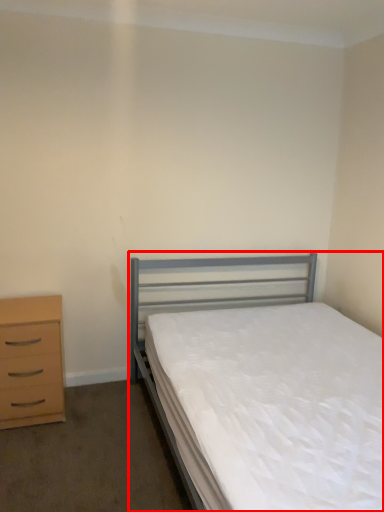
Question: From the image's perspective, where is bed (annotated by the red box) located in relation to chest of drawers in the image?

Choices:
 (A) above
 (B) below

Answer: (A)